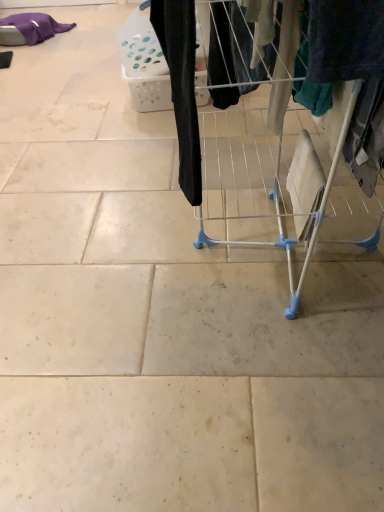
Question: Can you confirm if white wire drying rack at center is positioned to the right of black fabric pants at center, which is counted as the 2th clothing, starting from the top?

Choices:
 (A) yes
 (B) no

Answer: (A)

Question: Does white wire drying rack at center appear on the left side of black fabric pants at center, which appears as the 2th clothing when viewed from the left?

Choices:
 (A) no
 (B) yes

Answer: (A)

Question: From the image's perspective, would you say white wire drying rack at center is shown under black fabric pants at center, which appears as the 2th clothing when viewed from the left?

Choices:
 (A) no
 (B) yes

Answer: (B)

Question: Considering the relative sizes of white wire drying rack at center and black fabric pants at center, which is counted as the 2th clothing, starting from the top, in the image provided, is white wire drying rack at center shorter than black fabric pants at center, which is counted as the 2th clothing, starting from the top,?

Choices:
 (A) yes
 (B) no

Answer: (B)

Question: Is white wire drying rack at center facing towards black fabric pants at center, which appears as the 2th clothing when viewed from the left?

Choices:
 (A) yes
 (B) no

Answer: (A)

Question: Does white wire drying rack at center have a greater width compared to black fabric pants at center, which appears as the 2th clothing when viewed from the left?

Choices:
 (A) no
 (B) yes

Answer: (B)

Question: Is black fabric pants at center, positioned as the first clothing in right-to-left order, closer to the viewer compared to white wire drying rack at center?

Choices:
 (A) yes
 (B) no

Answer: (B)

Question: Is there a large distance between black fabric pants at center, which is the first clothing in front-to-back order, and white wire drying rack at center?

Choices:
 (A) no
 (B) yes

Answer: (A)

Question: Can you confirm if black fabric pants at center, positioned as the first clothing in right-to-left order, is thinner than white wire drying rack at center?

Choices:
 (A) yes
 (B) no

Answer: (A)

Question: Does black fabric pants at center, which appears as the 2th clothing when viewed from the left, have a smaller size compared to white wire drying rack at center?

Choices:
 (A) yes
 (B) no

Answer: (A)

Question: Does black fabric pants at center, which appears as the 2th clothing when viewed from the left, have a lesser height compared to white wire drying rack at center?

Choices:
 (A) yes
 (B) no

Answer: (A)

Question: Is black fabric pants at center, which appears as the 2th clothing when viewed from the left, aimed at white wire drying rack at center?

Choices:
 (A) no
 (B) yes

Answer: (B)

Question: From a real-world perspective, is black fabric pants at center, which is counted as the 2th clothing, starting from the top, located beneath purple cotton blanket at upper left, which is counted as the 2th clothing, starting from the front?

Choices:
 (A) no
 (B) yes

Answer: (A)